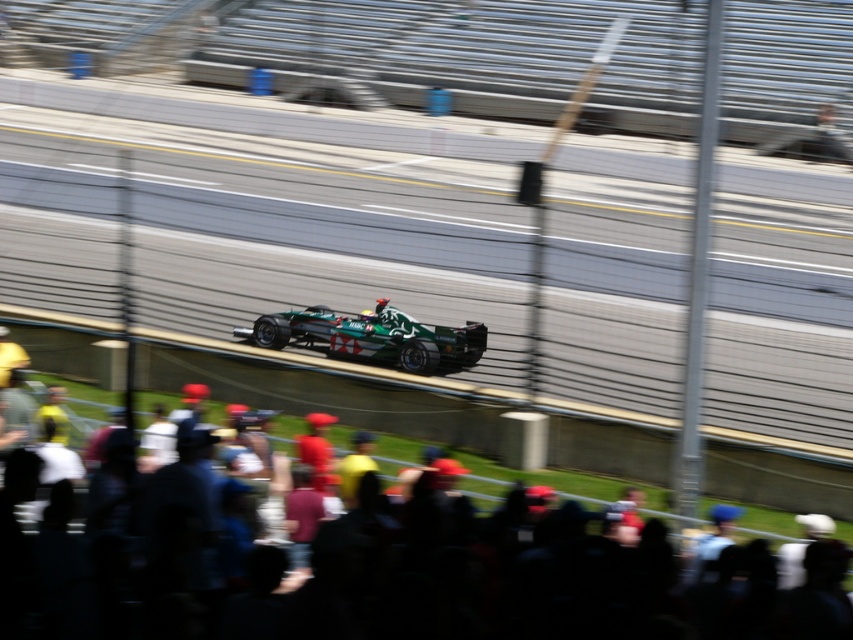
You are a photographer at the Formula One race. You want to capture a photo of the green matte race car at center without any spectators in the frame. Based on their positions, can you position yourself in a way to exclude the dark blue fabric crowd at lower center from the shot?

The dark blue fabric crowd at lower center is to the right of the green matte race car at center. To exclude the crowd, position yourself to the left side of the car so the crowd is out of frame.

You are a photographer at the Formula One race. You want to capture a photo of the green matte race car at center without any obstructions. Considering the dark blue fabric crowd at lower center, will they block your view of the car?

The dark blue fabric crowd at lower center is not as tall as the green matte race car at center, so they will not block your view of the car.